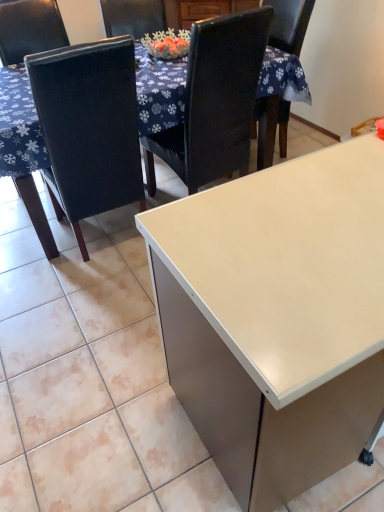
Question: From the image's perspective, is matte black chair at left, the first chair when ordered from left to right, located above white glossy desk at center?

Choices:
 (A) no
 (B) yes

Answer: (B)

Question: From a real-world perspective, is matte black chair at left, the first chair when ordered from left to right, on top of white glossy desk at center?

Choices:
 (A) yes
 (B) no

Answer: (A)

Question: Is matte black chair at left, the 2th chair from the right, not inside white glossy desk at center?

Choices:
 (A) yes
 (B) no

Answer: (A)

Question: Can you confirm if matte black chair at left, the first chair when ordered from left to right, is bigger than white glossy desk at center?

Choices:
 (A) no
 (B) yes

Answer: (A)

Question: From a real-world perspective, is matte black chair at left, the 2th chair from the right, beneath white glossy desk at center?

Choices:
 (A) no
 (B) yes

Answer: (A)

Question: Choose the correct answer: Is white glossy table at upper center inside black leather chair at upper center, placed as the 1th chair when sorted from right to left, or outside it?

Choices:
 (A) inside
 (B) outside

Answer: (B)

Question: Considering the positions of white glossy table at upper center and black leather chair at upper center, which ranks as the second chair in left-to-right order, in the image, is white glossy table at upper center bigger or smaller than black leather chair at upper center, which ranks as the second chair in left-to-right order,?

Choices:
 (A) big
 (B) small

Answer: (A)

Question: From their relative heights in the image, would you say white glossy table at upper center is taller or shorter than black leather chair at upper center, which ranks as the second chair in left-to-right order?

Choices:
 (A) short
 (B) tall

Answer: (A)

Question: Is white glossy table at upper center in front of or behind black leather chair at upper center, placed as the 1th chair when sorted from right to left, in the image?

Choices:
 (A) front
 (B) behind

Answer: (B)

Question: Choose the correct answer: Is black leather chair at upper center, placed as the 1th chair when sorted from right to left, inside white glossy desk at center or outside it?

Choices:
 (A) inside
 (B) outside

Answer: (B)

Question: Is point (233, 47) closer or farther from the camera than point (236, 426)?

Choices:
 (A) farther
 (B) closer

Answer: (A)

Question: Is black leather chair at upper center, which ranks as the second chair in left-to-right order, wider or thinner than white glossy desk at center?

Choices:
 (A) thin
 (B) wide

Answer: (A)

Question: From the image's perspective, is black leather chair at upper center, which ranks as the second chair in left-to-right order, above or below white glossy desk at center?

Choices:
 (A) below
 (B) above

Answer: (B)

Question: From the image's perspective, relative to matte black chair at left, the 2th chair from the right, is white glossy table at upper center above or below?

Choices:
 (A) above
 (B) below

Answer: (A)

Question: Relative to matte black chair at left, the 2th chair from the right, is white glossy table at upper center in front or behind?

Choices:
 (A) behind
 (B) front

Answer: (A)